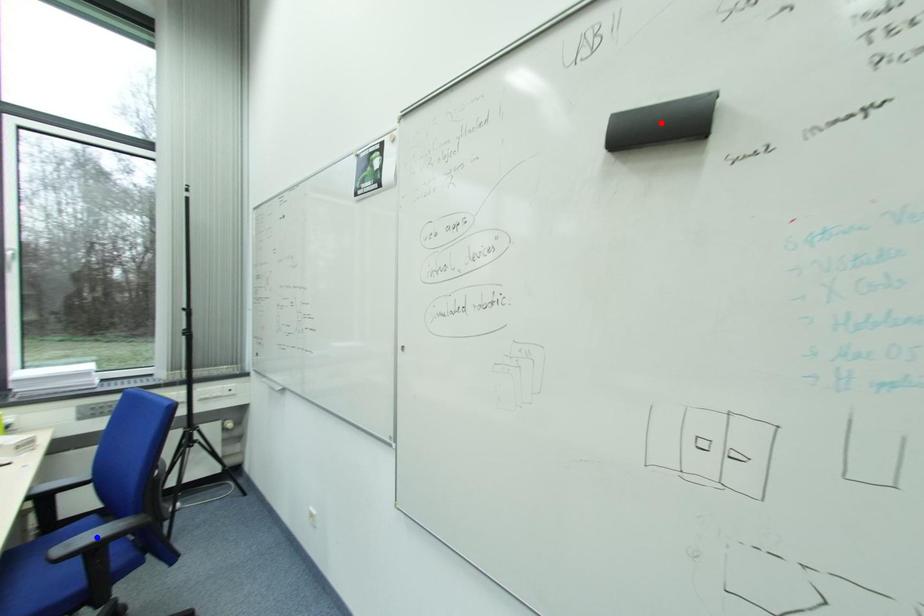
Question: Two points are marked on the image. Which point is closer to the camera?

Choices:
 (A) Blue point is closer.
 (B) Red point is closer.

Answer: (A)